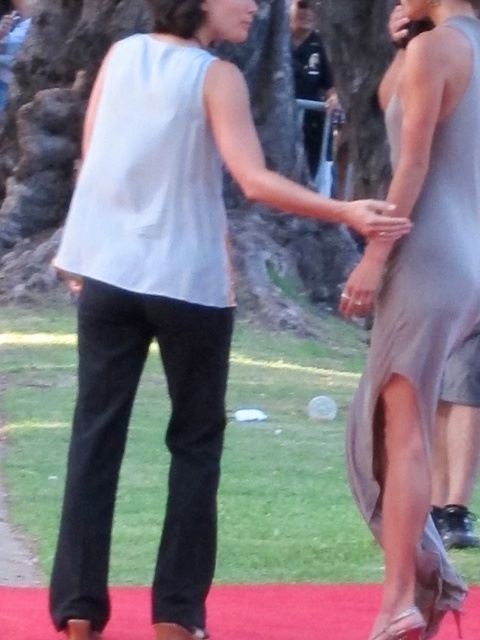
You are a photographer at the event and want to capture a closeup of the satin gray dress at right. Based on its position, where should you aim your camera?

The satin gray dress at right is located at point (418, 307), so you should aim your camera at that coordinate to capture it.

You are at point (355, 202) and want to move to point (300, 88). Is the path between you and your destination clear of any obstacles?

Point (300, 88) is behind point (355, 202), so there might be an obstacle between them. You should check for any objects blocking the path before moving.

You are a photographer at a fashion show. You need to capture a photo where both the satin gray dress at right and the satin silver dress at center are visible. Based on their positions, which dress should you focus on first to ensure both are in frame?

The satin gray dress at right is positioned under the satin silver dress at center. To ensure both are visible in the photo, focus on the satin silver dress at center first, as it is higher up and less likely to be obscured by the lower positioned satin gray dress at right.